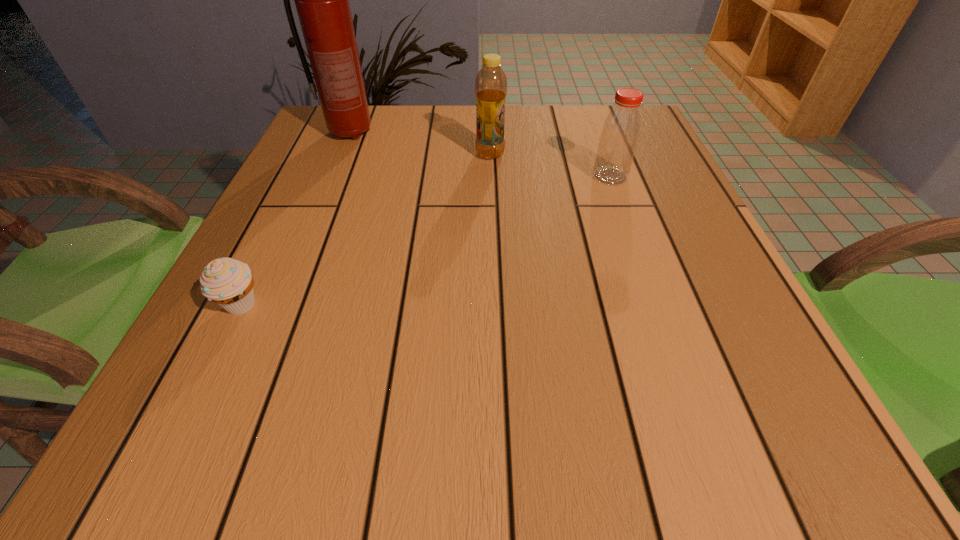
At what (x,y) coordinates should I click in order to perform the action: click on blank space that satisfies the following two spatial constraints: 1. on the handle side the farther bottle; 2. on the left side of the tallest object. Please return your answer as a coordinate pair (x, y). Looking at the image, I should click on (341, 154).